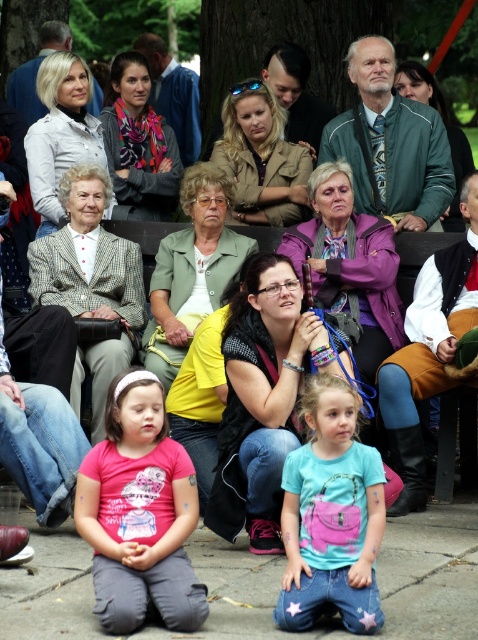
Question: Observing the image, what is the correct spatial positioning of checkered wool blazer at center in reference to purple fabric jacket at center?

Choices:
 (A) right
 (B) left

Answer: (B)

Question: Which is farther from the matte brown jacket at center?

Choices:
 (A) pink matte shirt at lower left
 (B) matte beige jacket at center

Answer: (A)

Question: Which point appears closest to the camera in this image?

Choices:
 (A) (295, 116)
 (B) (295, 400)
 (C) (427, 70)
 (D) (189, 252)

Answer: (B)

Question: Which object is farther from the camera taking this photo?

Choices:
 (A) green fabric jacket at center
 (B) purple fabric jacket at center
 (C) blue denim jeans at lower center

Answer: (A)

Question: In this image, where is checkered wool blazer at center located relative to matte brown jacket at center?

Choices:
 (A) right
 (B) left

Answer: (B)

Question: Does purple fabric jacket at center have a greater width compared to matte beige jacket at center?

Choices:
 (A) yes
 (B) no

Answer: (A)